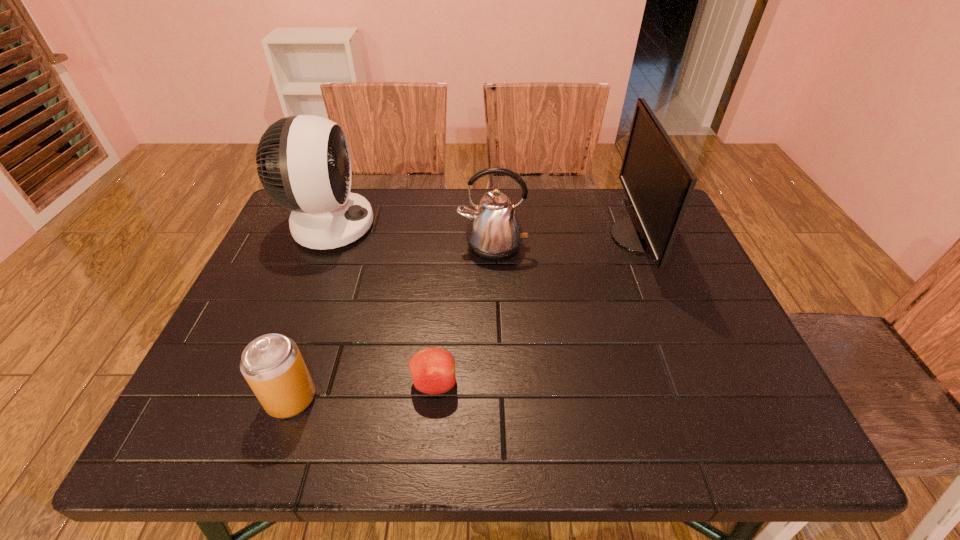
Locate an element on the screen. vacant space that satisfies the following two spatial constraints: 1. on the back side of the shortest object; 2. on the left side of the fourth tallest object is located at coordinates (296, 383).

Identify the location of vacant space that satisfies the following two spatial constraints: 1. on the screen side of the monitor; 2. on the front side of the pop (soda). (706, 398).

Locate an element on the screen. vacant space that satisfies the following two spatial constraints: 1. on the screen side of the monitor; 2. from the spout of the third tallest object is located at coordinates (643, 246).

Find the location of `free point that satisfies the following two spatial constraints: 1. on the grille of the pop (soda); 2. on the right side of the fan`. free point that satisfies the following two spatial constraints: 1. on the grille of the pop (soda); 2. on the right side of the fan is located at coordinates (260, 398).

Locate an element on the screen. vacant space that satisfies the following two spatial constraints: 1. on the grille of the shortest object; 2. on the left side of the fan is located at coordinates (266, 383).

Locate an element on the screen. This screenshot has height=540, width=960. free space in the image that satisfies the following two spatial constraints: 1. on the screen side of the rightmost object; 2. from the spout of the third shortest object is located at coordinates (643, 246).